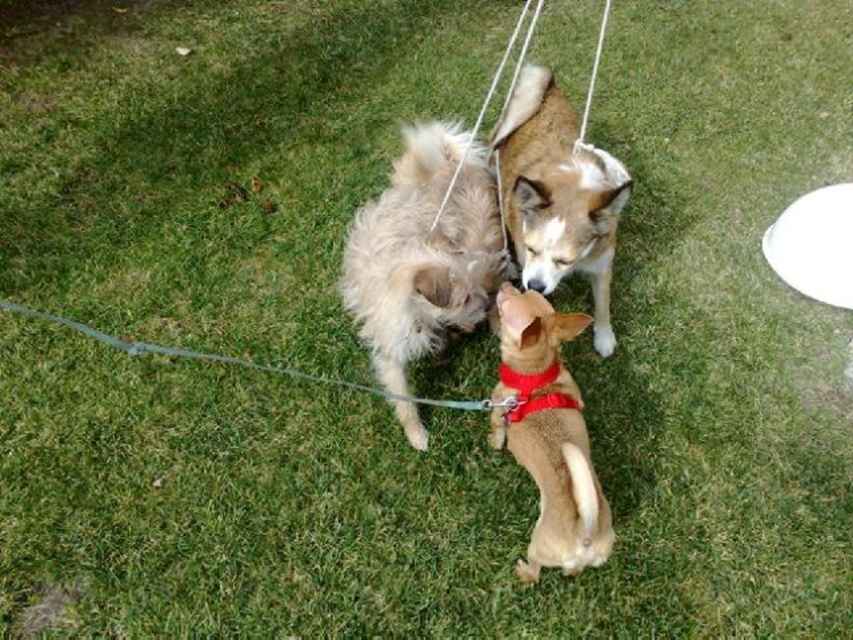
Between fuzzy beige dog at center and red fabric neckband at center, which one is positioned lower?

red fabric neckband at center is below.

Does fuzzy beige dog at center appear under red fabric neckband at center?

No, fuzzy beige dog at center is not below red fabric neckband at center.

Who is more distant from viewer, (x=440, y=268) or (x=537, y=376)?

Positioned behind is point (x=440, y=268).

This screenshot has width=853, height=640. I want to click on fuzzy beige dog at center, so click(x=422, y=252).

From the picture: Measure the distance from fuzzy beige dog at center to metallic silver leash at center.

A distance of 18.07 inches exists between fuzzy beige dog at center and metallic silver leash at center.

The height and width of the screenshot is (640, 853). I want to click on fuzzy beige dog at center, so click(422, 252).

Who is more distant from viewer, (399, 410) or (270, 369)?

The point (270, 369) is behind.

Where is `fuzzy beige dog at center`? The width and height of the screenshot is (853, 640). fuzzy beige dog at center is located at coordinates (422, 252).

Can you confirm if fuzzy beige dog at center is taller than white string at upper center?

Correct, fuzzy beige dog at center is much taller as white string at upper center.

Can you confirm if fuzzy beige dog at center is positioned above white string at upper center?

Incorrect, fuzzy beige dog at center is not positioned above white string at upper center.

The height and width of the screenshot is (640, 853). Find the location of `fuzzy beige dog at center`. fuzzy beige dog at center is located at coordinates (422, 252).

Identify the location of fuzzy beige dog at center. This screenshot has height=640, width=853. (422, 252).